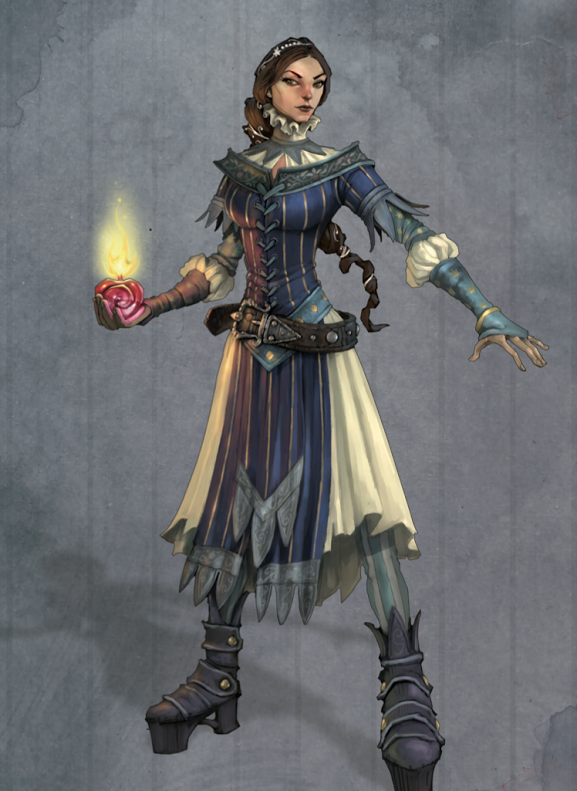
At what (x,y) coordinates should I click in order to perform the action: click on candle. Please return your answer as a coordinate pair (x, y). Looking at the image, I should click on (129, 305).